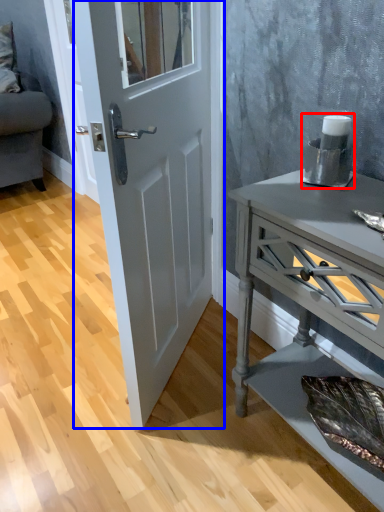
Question: Among these objects, which one is farthest to the camera, appliance (highlighted by a red box) or door (highlighted by a blue box)?

Choices:
 (A) appliance
 (B) door

Answer: (A)